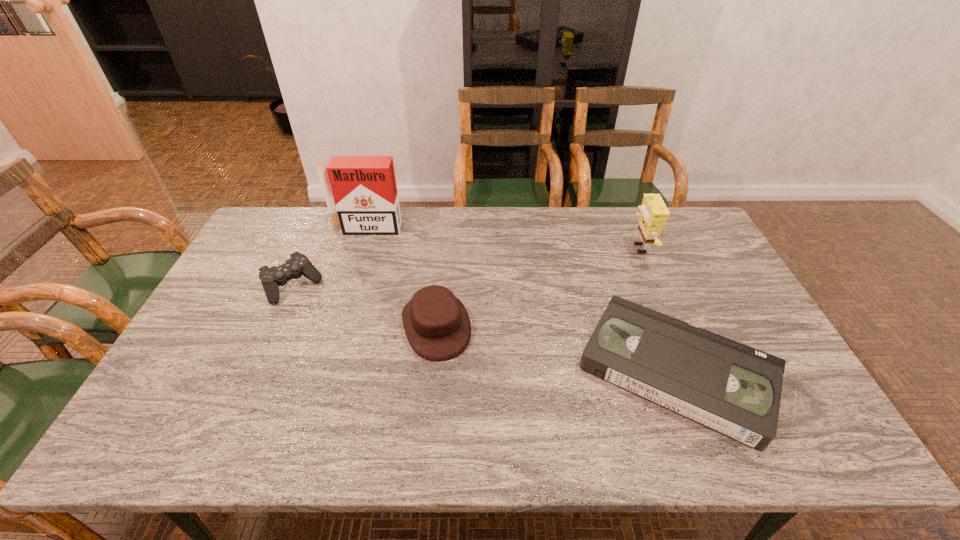
Find the location of a particular element. vacant space in between the second tallest object and the hat is located at coordinates (538, 287).

The image size is (960, 540). In order to click on free point between the hat and the sponge in this screenshot , I will do `click(538, 287)`.

What are the coordinates of `vacant area between the tallest object and the shortest object` in the screenshot? It's located at (521, 300).

Identify the location of object that stands as the third closest to the control. (731, 388).

Point out which object is positioned as the fourth nearest to the sponge. Please provide its 2D coordinates. Your answer should be formatted as a tuple, i.e. [(x, y)], where the tuple contains the x and y coordinates of a point satisfying the conditions above.

[(298, 265)]

Find the location of `vacant space that satisfies the following two spatial constraints: 1. on the front side of the control; 2. on the left side of the shortest object`. vacant space that satisfies the following two spatial constraints: 1. on the front side of the control; 2. on the left side of the shortest object is located at coordinates (255, 371).

Locate an element on the screen. Image resolution: width=960 pixels, height=540 pixels. vacant position in the image that satisfies the following two spatial constraints: 1. on the front-facing side of the third object from right to left; 2. on the left side of the cigarette case is located at coordinates (335, 326).

Where is `free location that satisfies the following two spatial constraints: 1. on the front side of the videotape; 2. on the right side of the third object from left to right`? The image size is (960, 540). free location that satisfies the following two spatial constraints: 1. on the front side of the videotape; 2. on the right side of the third object from left to right is located at coordinates [x=432, y=371].

Identify the location of vacant space that satisfies the following two spatial constraints: 1. on the front-facing side of the shortest object; 2. on the right side of the cigarette case. The width and height of the screenshot is (960, 540). (321, 371).